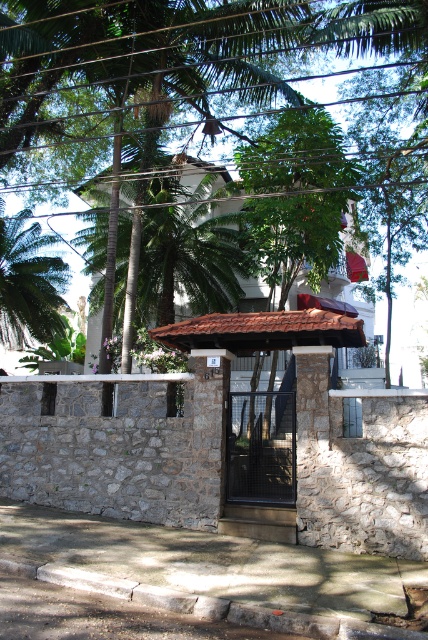
Question: Which point is farther to the camera?

Choices:
 (A) green leafy palm tree at center
 (B) green leafy palm tree at left

Answer: (B)

Question: Can you confirm if green leafy palm tree at center is positioned to the left of green leafy palm tree at left?

Choices:
 (A) no
 (B) yes

Answer: (A)

Question: Can you confirm if green leafy palm tree at center is positioned to the left of green leafy palm tree at left?

Choices:
 (A) yes
 (B) no

Answer: (B)

Question: Among these points, which one is farthest from the camera?

Choices:
 (A) (168, 248)
 (B) (2, 316)

Answer: (B)

Question: Which point appears farthest from the camera in this image?

Choices:
 (A) (193, 307)
 (B) (38, 243)

Answer: (A)

Question: Can you confirm if green leafy palm tree at center is positioned to the left of green leafy palm tree at left?

Choices:
 (A) yes
 (B) no

Answer: (B)